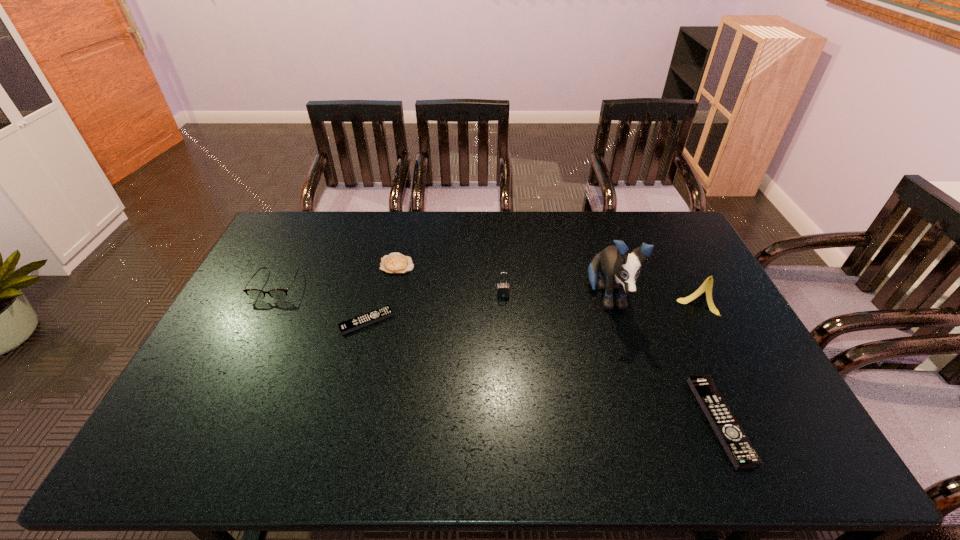
Please mark a free spot for a new remote_control to balance the arrangement. Please provide its 2D coordinates. Your answer should be formatted as a tuple, i.e. [(x, y)], where the tuple contains the x and y coordinates of a point satisfying the conditions above.

[(525, 366)]